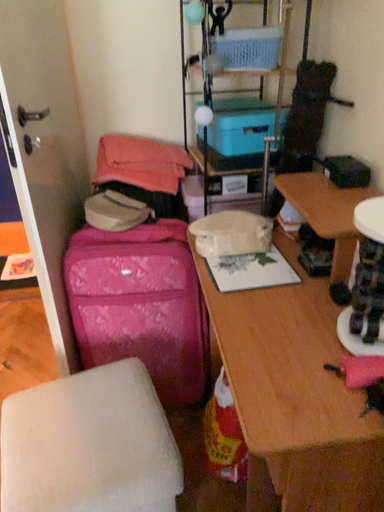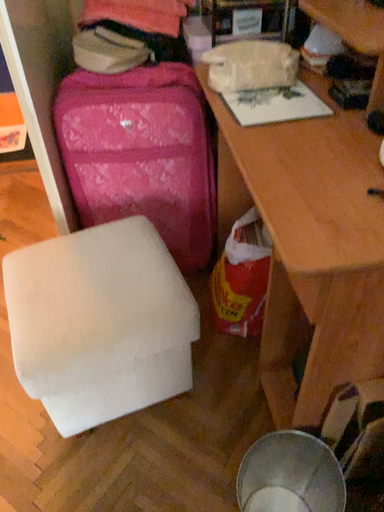
Question: How did the camera likely rotate when shooting the video?

Choices:
 (A) rotated downward
 (B) rotated upward

Answer: (A)